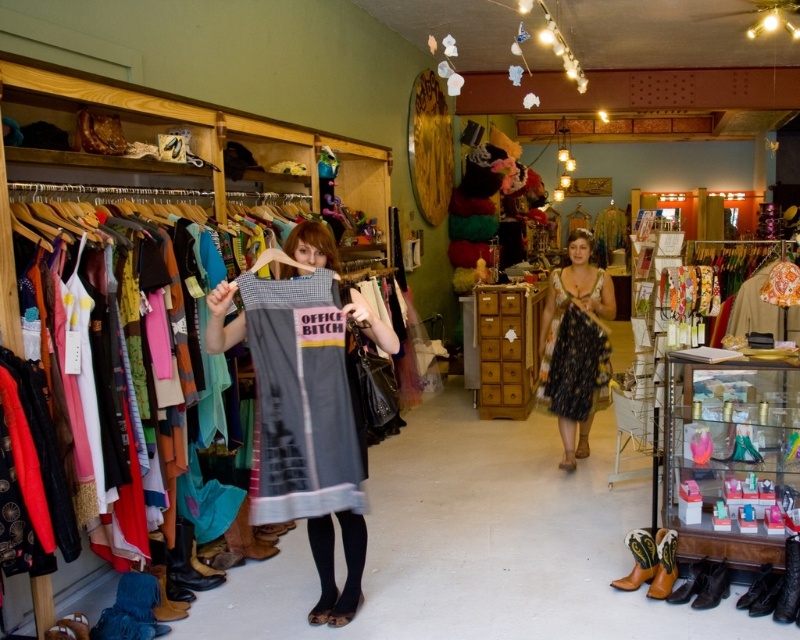
Who is more forward, (x=728, y=552) or (x=542, y=384)?

Point (x=728, y=552) is more forward.

Which is above, clear glass display case at center or floral-patterned dress at center?

floral-patterned dress at center is higher up.

This screenshot has height=640, width=800. Describe the element at coordinates (729, 458) in the screenshot. I see `clear glass display case at center` at that location.

Find the location of a particular element. clear glass display case at center is located at coordinates (729, 458).

Is clear glass display case at center smaller than matte gray dress at center?

Yes, clear glass display case at center is smaller than matte gray dress at center.

Does clear glass display case at center have a lesser height compared to matte gray dress at center?

Correct, clear glass display case at center is not as tall as matte gray dress at center.

Who is more distant from viewer, (698, 371) or (328, 364)?

The point (698, 371) is more distant.

Locate an element on the screen. The image size is (800, 640). clear glass display case at center is located at coordinates (729, 458).

Is matte gray dress at center below floral-patterned dress at center?

Yes.

Can you confirm if matte gray dress at center is taller than floral-patterned dress at center?

Yes.

Describe the element at coordinates (333, 563) in the screenshot. I see `matte gray dress at center` at that location.

Locate an element on the screen. The image size is (800, 640). matte gray dress at center is located at coordinates (333, 563).